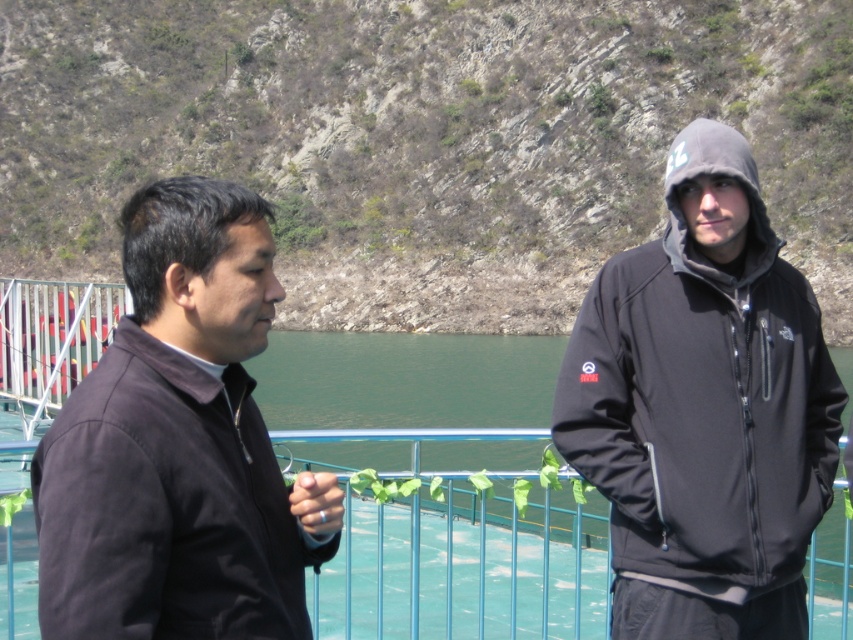
Question: Is matte black hoodie at right positioned behind dark matte jacket at left?

Choices:
 (A) yes
 (B) no

Answer: (A)

Question: Can you confirm if matte black hoodie at right is positioned below dark matte jacket at left?

Choices:
 (A) yes
 (B) no

Answer: (B)

Question: Does matte black hoodie at right appear on the right side of dark matte jacket at left?

Choices:
 (A) yes
 (B) no

Answer: (A)

Question: Among these objects, which one is nearest to the camera?

Choices:
 (A) dark matte jacket at left
 (B) matte black hoodie at right

Answer: (A)